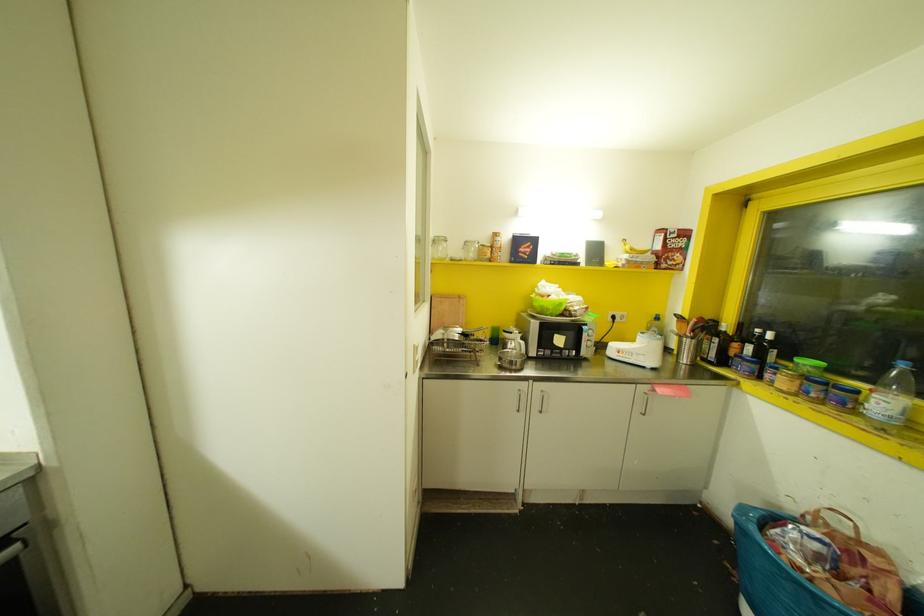
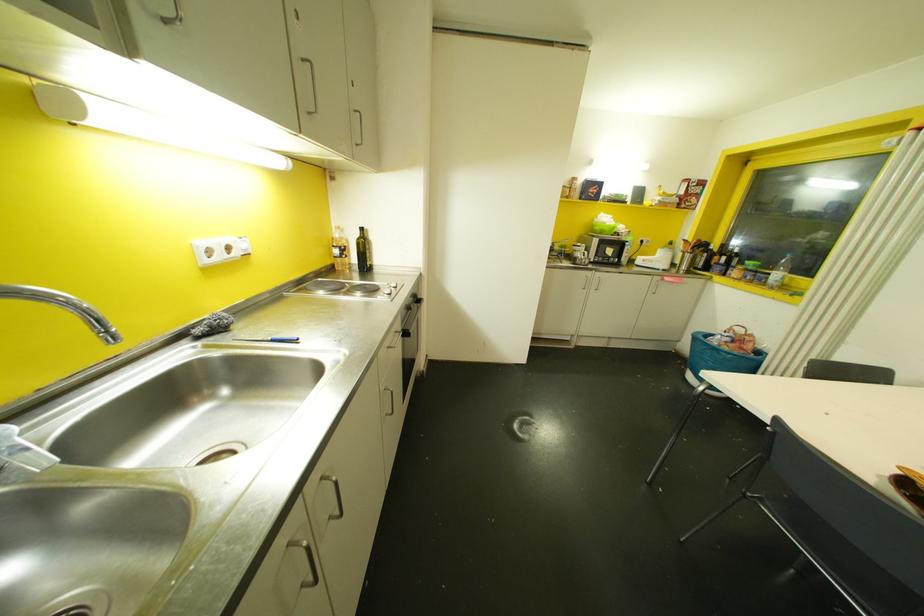
What movement of the cameraman would produce the second image?

The movement direction of the cameraman is left, backward.